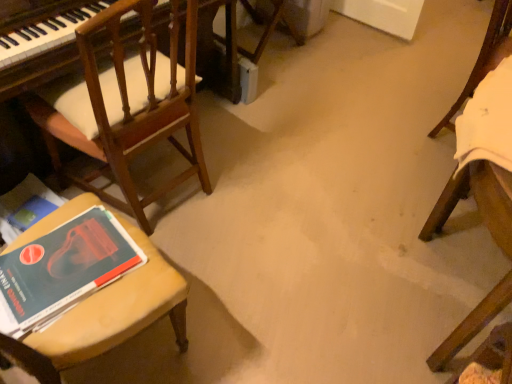
Image resolution: width=512 pixels, height=384 pixels. In order to click on empty space that is ontop of hardcover book at lower left (from a real-world perspective) in this screenshot , I will do `click(47, 287)`.